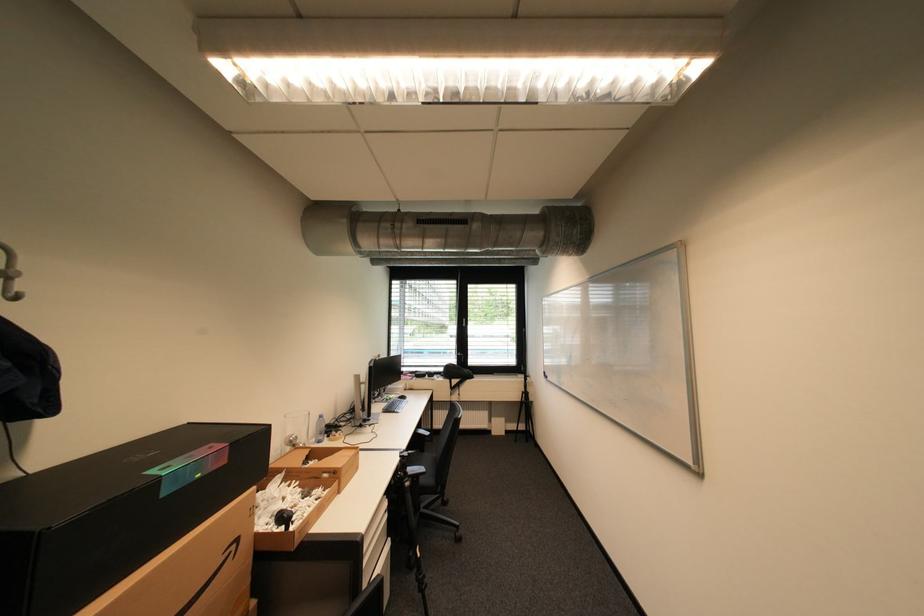
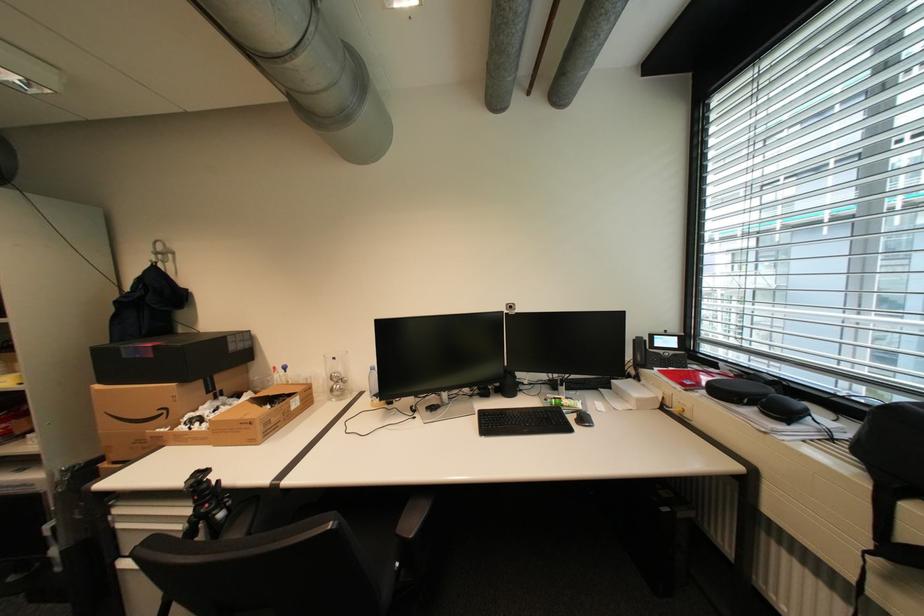
Locate, in the second image, the point that corresponds to (367,454) in the first image.

(259, 424)